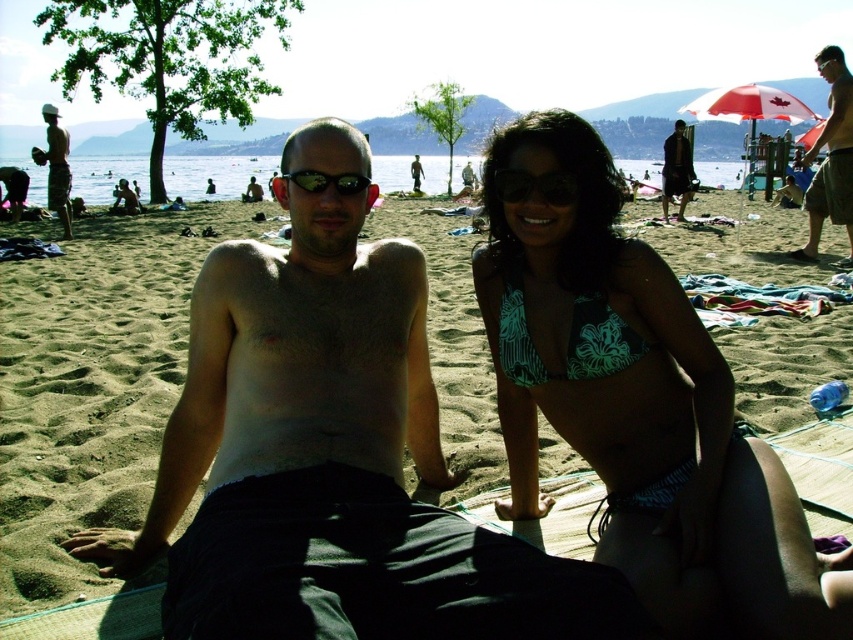
You are a photographer trying to capture a clear shot of both the teal floral bikini top at center and the black rubber goggles at center. Since you want both objects in focus, which one should you adjust your camera lens to focus on first?

The teal floral bikini top at center is in front of the black rubber goggles at center, so you should focus on the teal floral bikini top at center first to ensure both are in focus.